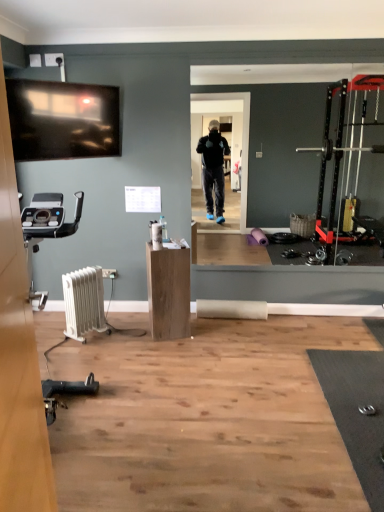
You are a GUI agent. You are given a task and a screenshot of the screen. Output one action in this format:
    pyautogui.click(x=<x>, y=<y>)
    Task: Click on the free spot to the right of white plastic radiator at lower left
    The height and width of the screenshot is (512, 384).
    Given the screenshot: What is the action you would take?
    point(119,337)